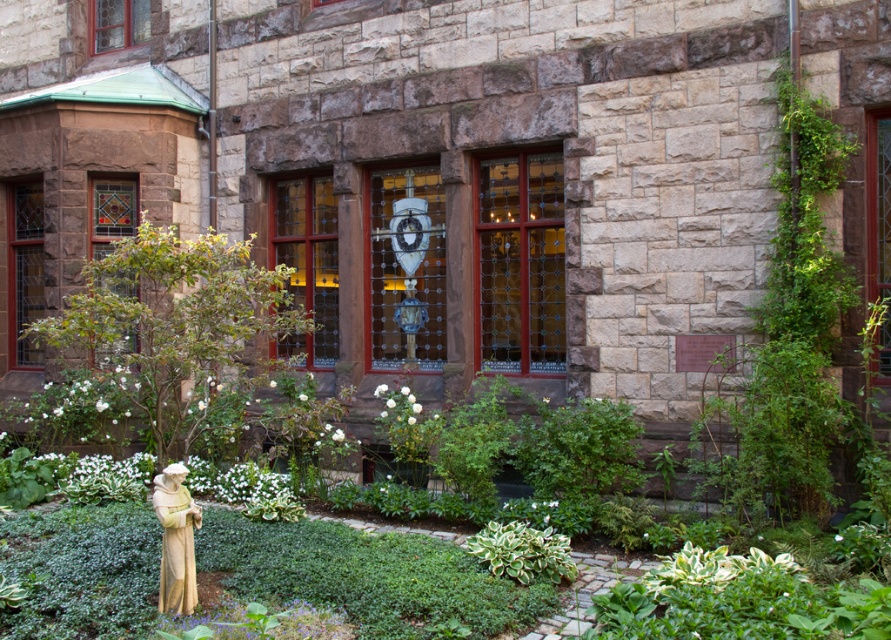
Between stone statue at lower left and variegated leafy plant at center, which one has less height?

variegated leafy plant at center is shorter.

Which is more to the right, stone statue at lower left or variegated leafy plant at center?

Positioned to the right is variegated leafy plant at center.

Find the location of a particular element. stone statue at lower left is located at coordinates (176, 540).

Is green leafy bush at lower left to the left of stone statue at lower left from the viewer's perspective?

Yes, green leafy bush at lower left is to the left of stone statue at lower left.

Between point (208, 413) and point (190, 532), which one is positioned in front?

Point (190, 532) is more forward.

Is point (181, 444) less distant than point (162, 538)?

No, it is behind (162, 538).

Where is `green leafy bush at lower left`? green leafy bush at lower left is located at coordinates (170, 326).

Does point (94, 314) come farther from viewer compared to point (511, 570)?

That is True.

Does green leafy bush at lower left have a greater width compared to variegated leafy plant at center?

Yes, green leafy bush at lower left is wider than variegated leafy plant at center.

At what (x,y) coordinates should I click in order to perform the action: click on green leafy bush at lower left. Please return your answer as a coordinate pair (x, y). The image size is (891, 640). Looking at the image, I should click on (170, 326).